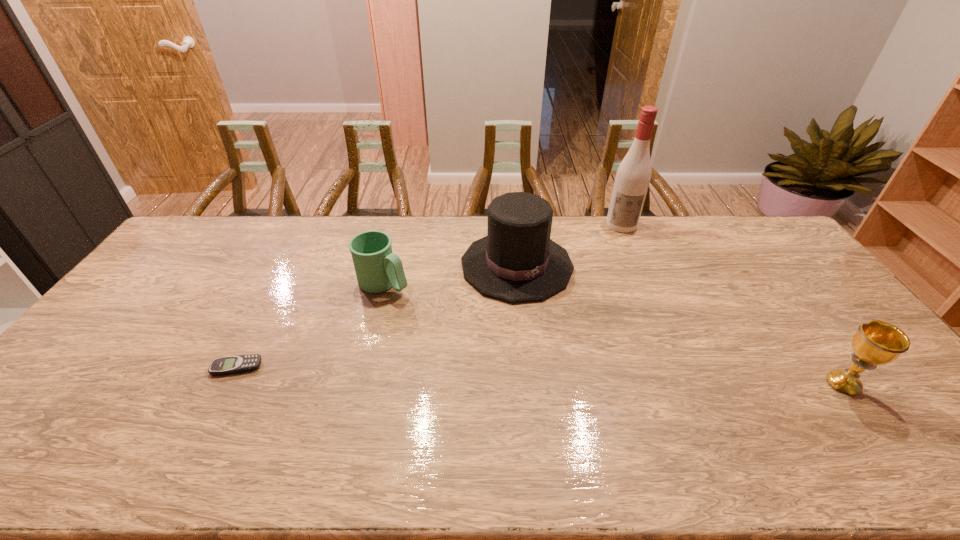
Image resolution: width=960 pixels, height=540 pixels. I want to click on vacant space on the desktop that is between the shortest object and the rightmost object and is positioned on the side of the mug with the handle, so click(544, 376).

Identify the location of free space on the desktop that is between the beeper and the rightmost object and is positioned on the front of the second tallest object with the decoration. The width and height of the screenshot is (960, 540). (600, 377).

This screenshot has height=540, width=960. I want to click on free space on the desktop that is between the beeper and the third shortest object and is positioned on the label of the alcohol, so click(x=623, y=378).